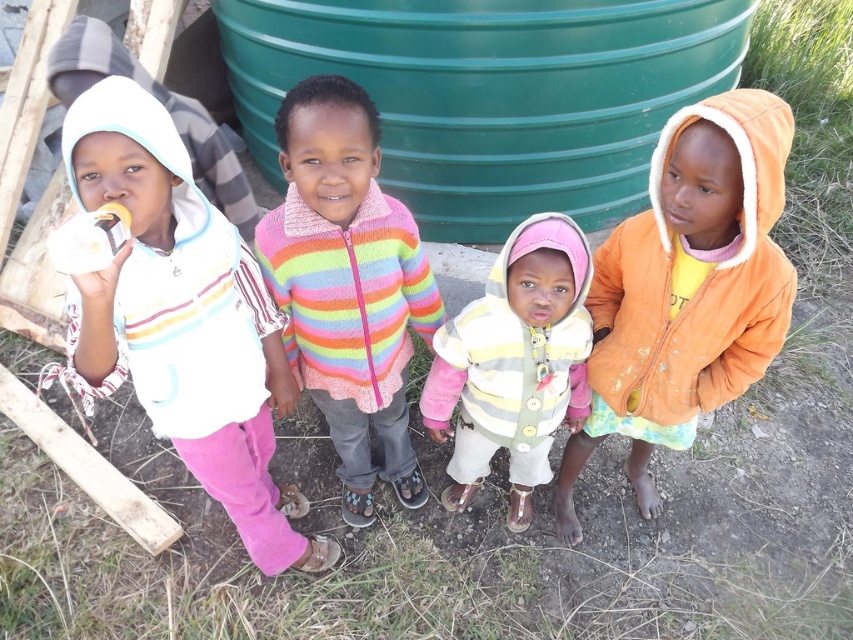
Is multicolored knitted sweater at center shorter than striped knit sweater at center?

In fact, multicolored knitted sweater at center may be taller than striped knit sweater at center.

Is point (323, 172) more distant than point (524, 506)?

No, it is in front of (524, 506).

Image resolution: width=853 pixels, height=640 pixels. What are the coordinates of `multicolored knitted sweater at center` in the screenshot? It's located at [x=347, y=285].

Can you confirm if white fleece hoodie at left is wider than multicolored knitted sweater at center?

In fact, white fleece hoodie at left might be narrower than multicolored knitted sweater at center.

Can you confirm if white fleece hoodie at left is positioned above multicolored knitted sweater at center?

No, white fleece hoodie at left is not above multicolored knitted sweater at center.

Does point (119, 317) come behind point (392, 388)?

No, it is not.

Find the location of a particular element. white fleece hoodie at left is located at coordinates (183, 320).

Between white fleece hoodie at left and striped knit sweater at center, which one is positioned lower?

striped knit sweater at center is below.

Does white fleece hoodie at left come in front of striped knit sweater at center?

That is True.

Between point (202, 420) and point (514, 413), which one is positioned in front?

Positioned in front is point (202, 420).

Identify the location of white fleece hoodie at left. (183, 320).